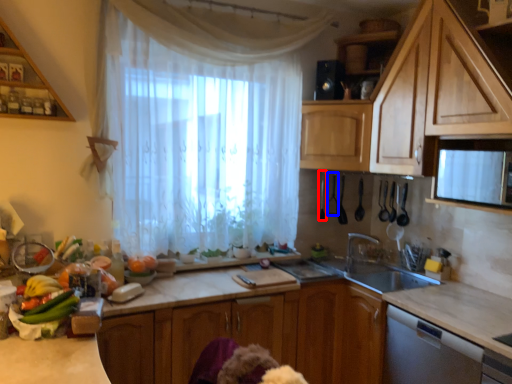
Question: Which of the following is the farthest to the observer, appliance (highlighted by a red box) or appliance (highlighted by a blue box)?

Choices:
 (A) appliance
 (B) appliance

Answer: (B)